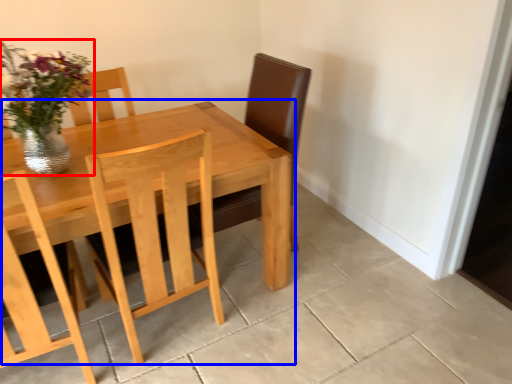
Question: Among these objects, which one is farthest to the camera, floral arrangement (highlighted by a red box) or kitchen & dining room table (highlighted by a blue box)?

Choices:
 (A) floral arrangement
 (B) kitchen & dining room table

Answer: (A)